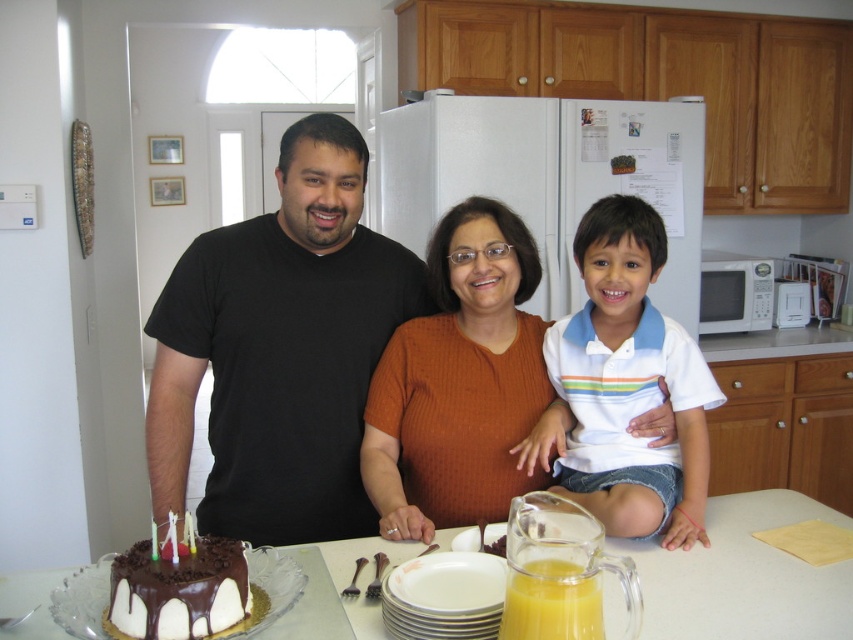
Question: Which of the following is the farthest from the observer?

Choices:
 (A) translucent glass pitcher of orange juice at lower center
 (B) white glossy microwave at right

Answer: (B)

Question: Among these objects, which one is farthest from the camera?

Choices:
 (A) white glossy table at center
 (B) white cotton shirt at center

Answer: (B)

Question: Can you confirm if chocolate glaze cake at lower left is positioned below translucent glass pitcher of orange juice at lower center?

Choices:
 (A) yes
 (B) no

Answer: (A)

Question: Does white glossy table at center come in front of chocolate glaze cake at lower left?

Choices:
 (A) no
 (B) yes

Answer: (A)

Question: Does white glossy table at center appear under white glossy microwave at right?

Choices:
 (A) yes
 (B) no

Answer: (A)

Question: Estimate the real-world distances between objects in this image. Which object is farther from the white cotton shirt at center?

Choices:
 (A) white glossy table at center
 (B) translucent glass pitcher of orange juice at lower center

Answer: (B)